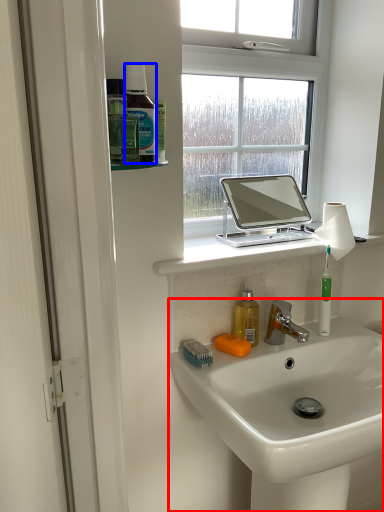
Question: Which point is further to the camera, sink (highlighted by a red box) or mouthwash (highlighted by a blue box)?

Choices:
 (A) sink
 (B) mouthwash

Answer: (B)